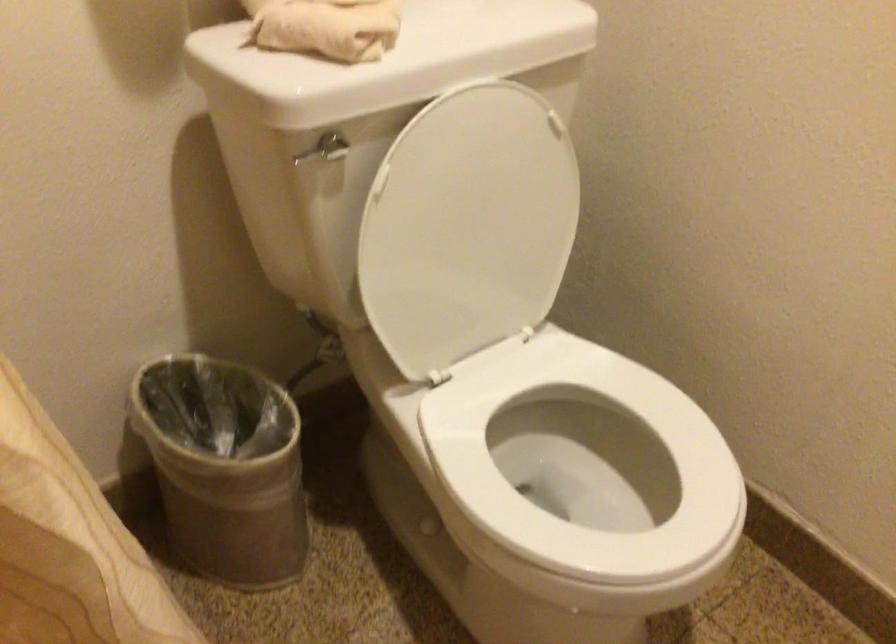
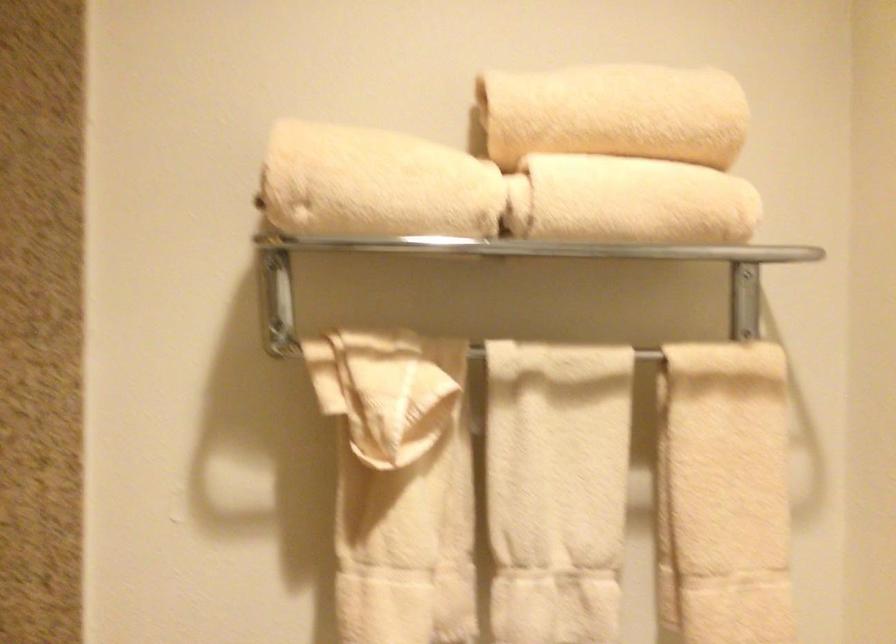
Based on the continuous images, in which direction is the camera rotating?

The camera's rotation is toward left-up.